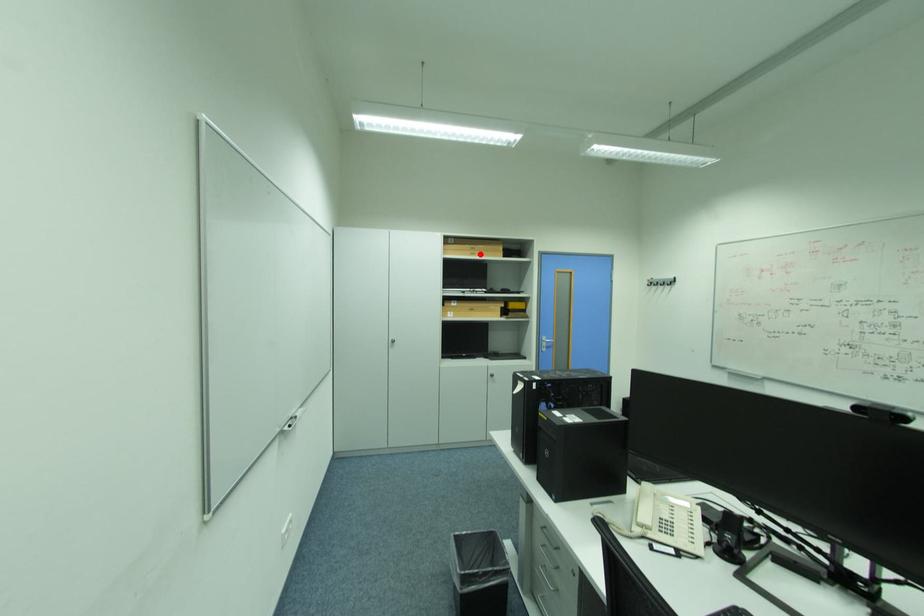
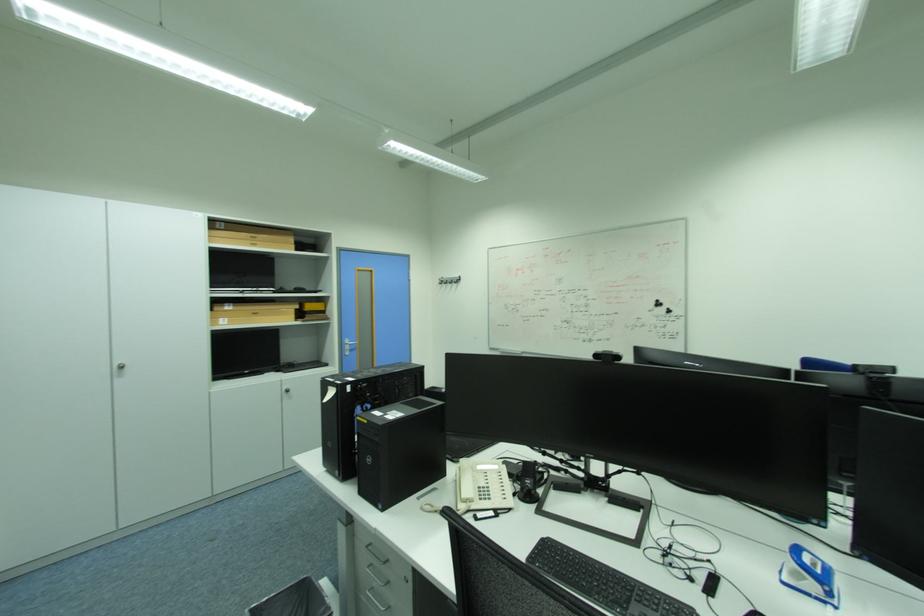
Where in the second image is the point corresponding to the highlighted location from the first image?

(261, 246)